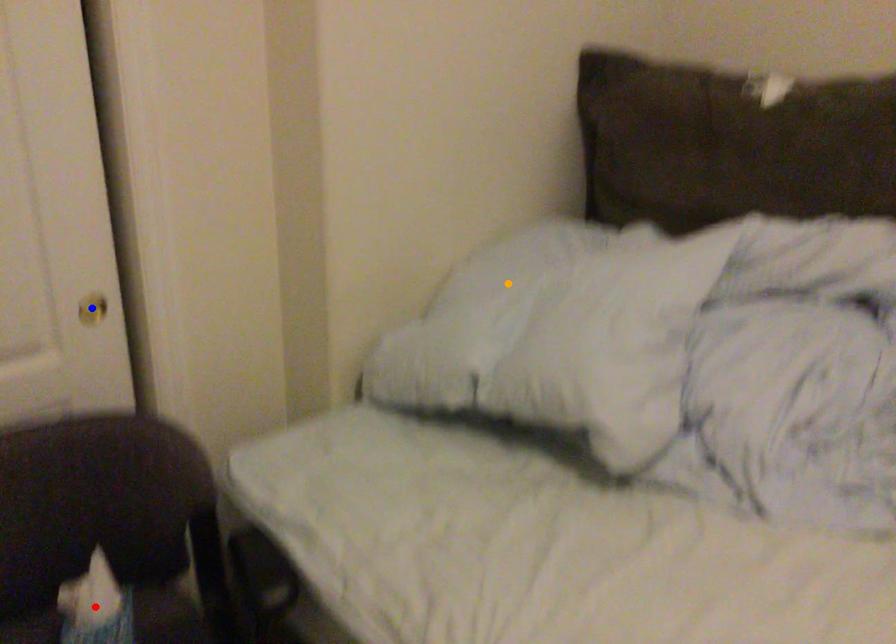
Order these from nearest to farthest:
A) blue point
B) orange point
C) red point

red point → blue point → orange point